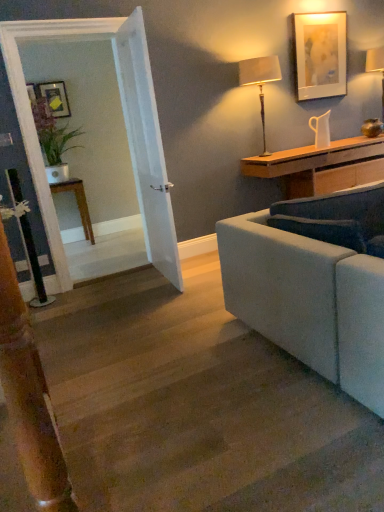
Locate an element on the screen. This screenshot has height=512, width=384. vacant area that is situated to the right of white wooden door at left is located at coordinates (200, 274).